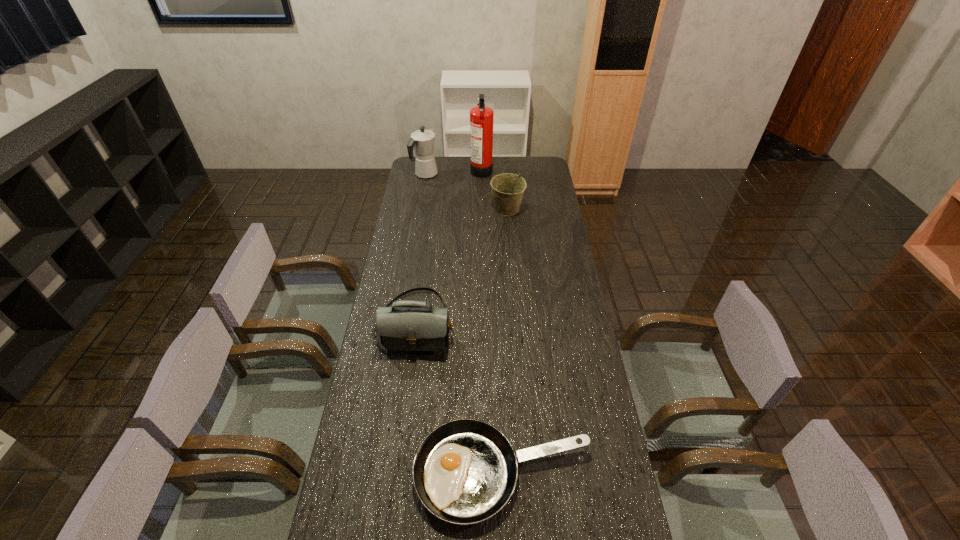
The image size is (960, 540). I want to click on free space that satisfies the following two spatial constraints: 1. on the front-facing side of the tallest object; 2. on the back side of the shortest object, so (483, 474).

Find the location of a particular element. The height and width of the screenshot is (540, 960). free space that satisfies the following two spatial constraints: 1. on the front-facing side of the fire extinguisher; 2. on the front side of the fourth farthest object is located at coordinates click(x=482, y=322).

Locate an element on the screen. Image resolution: width=960 pixels, height=540 pixels. free region that satisfies the following two spatial constraints: 1. on the front side of the nearest object; 2. on the left side of the coffeepot is located at coordinates (374, 474).